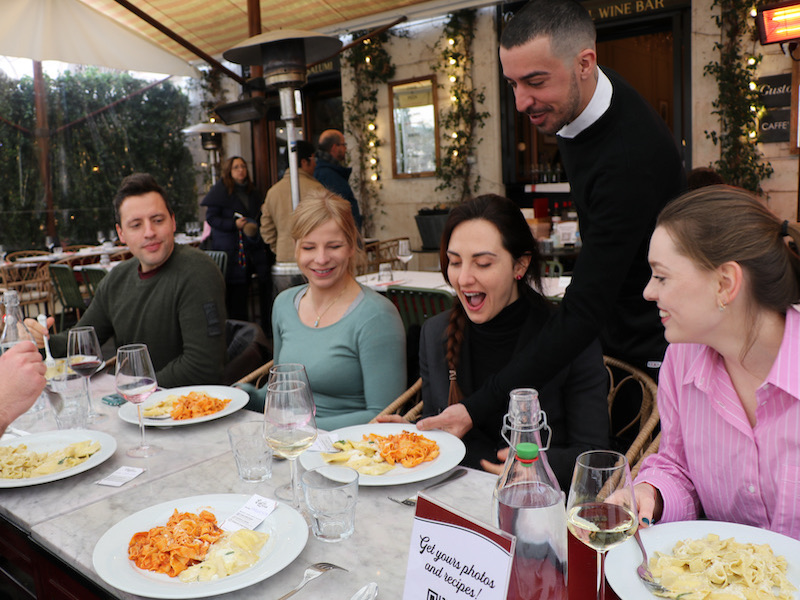
Find the location of a particular element. The height and width of the screenshot is (600, 800). food on plates is located at coordinates (38, 457), (157, 539), (205, 402), (402, 447), (741, 569).